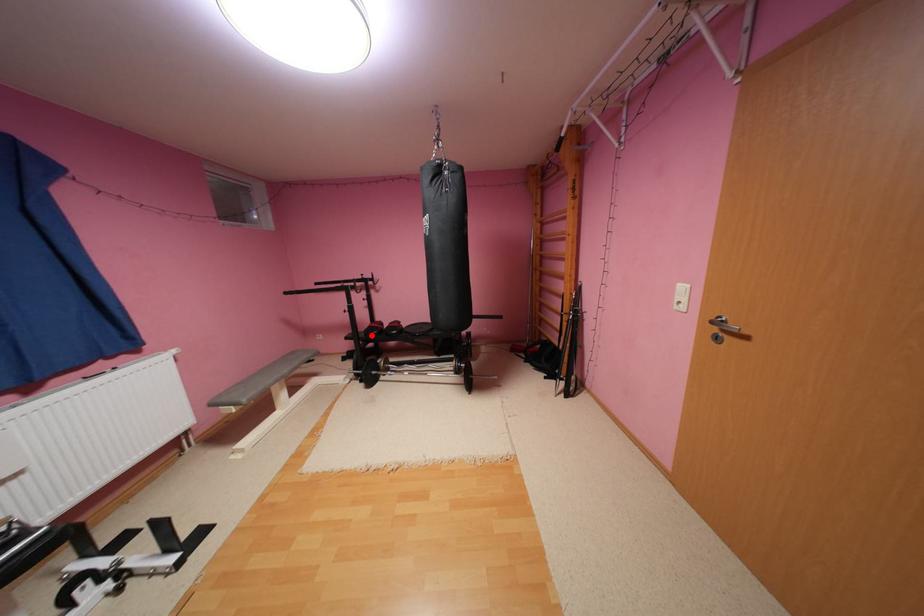
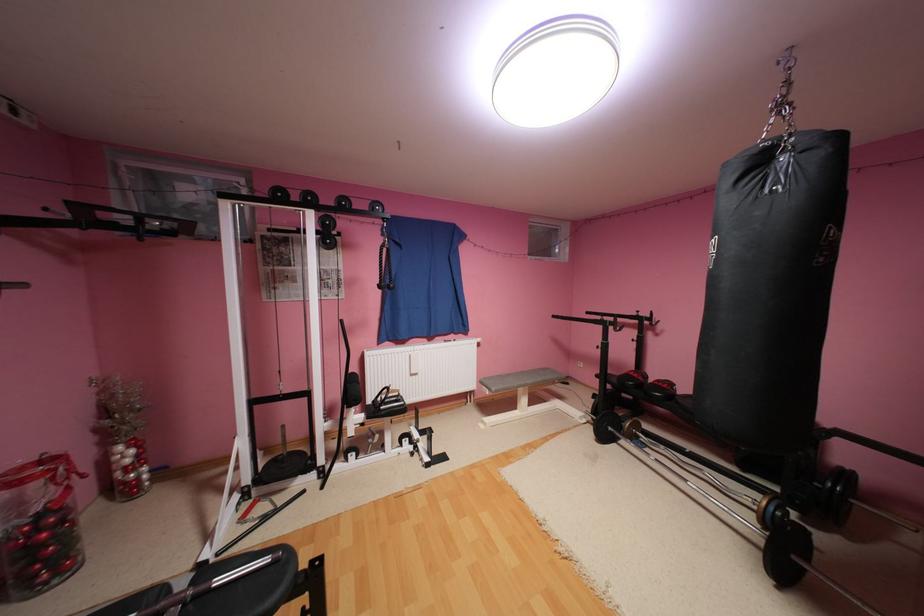
Question: I am providing you with two images of the same scene from different viewpoints. In image1, a red point is highlighted. Considering the same 3D point in image2, which of the following is correct?

Choices:
 (A) It is closer
 (B) It is farther

Answer: (B)